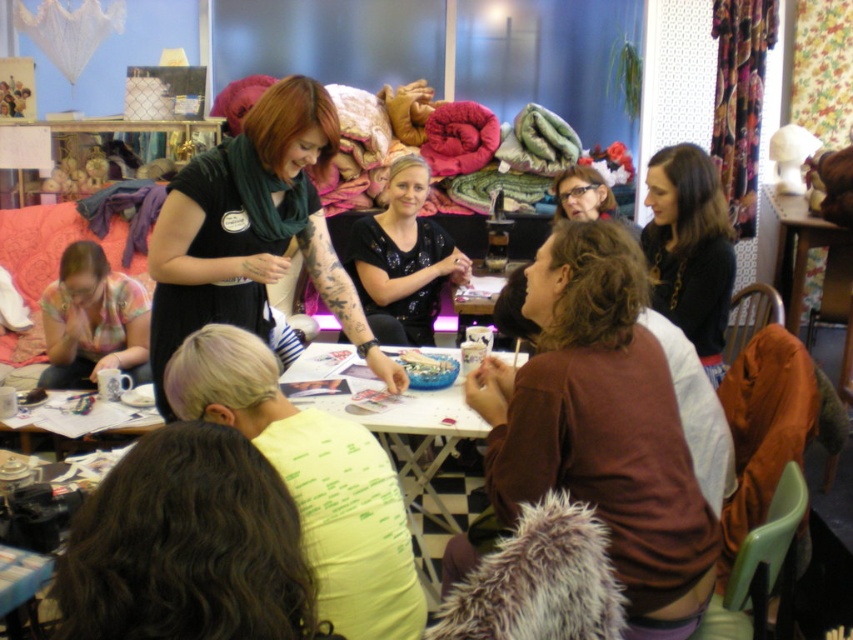
Question: Which point is closer to the camera?

Choices:
 (A) (418, 500)
 (B) (717, 296)
 (C) (612, 212)
 (D) (112, 360)

Answer: (B)

Question: Where is dark brown curly hair at lower left located in relation to black fabric at upper right in the image?

Choices:
 (A) left
 (B) right

Answer: (A)

Question: Is brown fuzzy sweater at center below floral fabric shirt at lower left?

Choices:
 (A) no
 (B) yes

Answer: (B)

Question: Among these objects, which one is farthest from the camera?

Choices:
 (A) light yellow fabric at center
 (B) matte brown hair at center

Answer: (B)

Question: Which object is the farthest from the matte brown hair at center?

Choices:
 (A) white glossy table at center
 (B) black fabric at upper right
 (C) black matte shirt at center
 (D) brown fuzzy sweater at center

Answer: (D)

Question: Can you confirm if brown fuzzy sweater at center is positioned below black matte shirt at center?

Choices:
 (A) no
 (B) yes

Answer: (B)